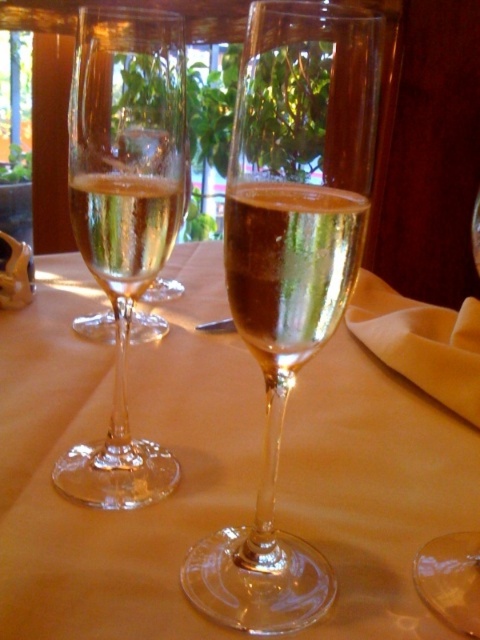
Question: Can you confirm if clear glass wine glass at center is wider than clear glass wine glass at left?

Choices:
 (A) no
 (B) yes

Answer: (A)

Question: Which point is closer to the camera taking this photo?

Choices:
 (A) (262, 362)
 (B) (420, 365)

Answer: (A)

Question: Which of the following is the closest to the observer?

Choices:
 (A) clear glass wine glass at left
 (B) clear glass champagne at center
 (C) beige satin napkin at lower right
 (D) clear glass wine glasses at center

Answer: (B)

Question: Does clear glass wine glasses at center come in front of clear glass champagne at center?

Choices:
 (A) no
 (B) yes

Answer: (A)

Question: Is beige satin napkin at lower right smaller than clear glass champagne at left?

Choices:
 (A) no
 (B) yes

Answer: (A)

Question: Which is farther from the clear glass wine glass at left?

Choices:
 (A) clear glass champagne at left
 (B) clear glass wine glass at center
 (C) clear glass wine glasses at center
 (D) clear glass champagne at center

Answer: (D)